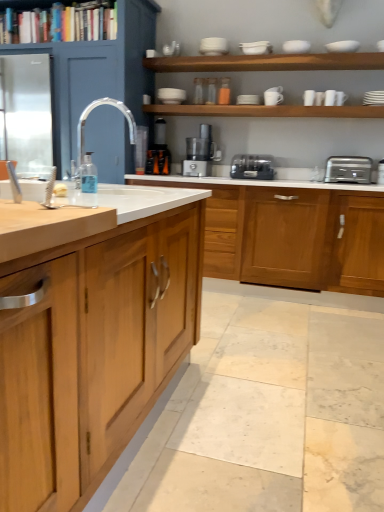
Locate an element on the screen. This screenshot has height=512, width=384. vacant region above white matte plate at upper center, acting as the 3th tableware starting from the left (from a real-world perspective) is located at coordinates (249, 94).